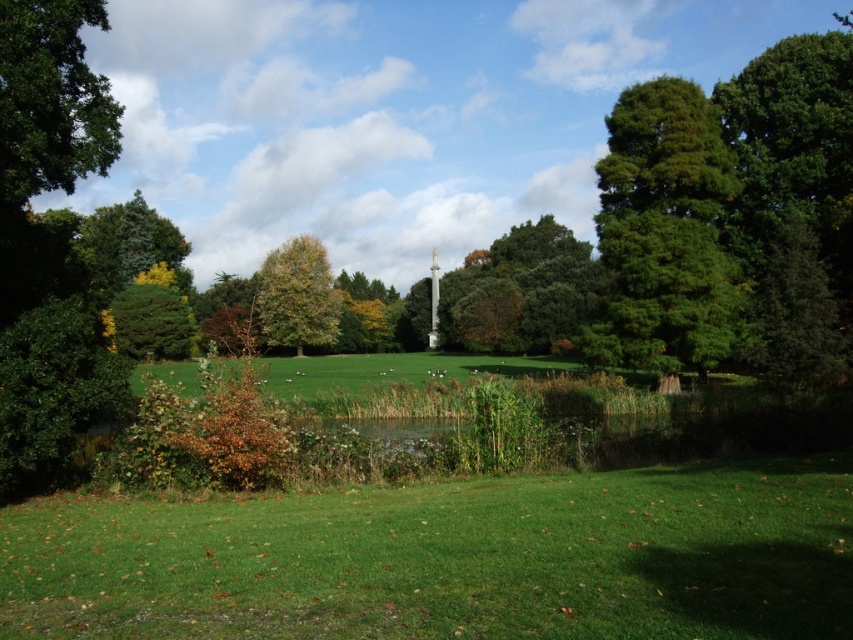
You are standing in the park and want to take a photo of the green leafy tree at upper left without the green grassy field at lower center blocking the view. Is this possible?

A: The green grassy field at lower center is in front of the green leafy tree at upper left, so it will block the view. Move to a higher position or angle your camera upwards to avoid the obstruction.

You are standing in the park and want to walk from the green leafy tree at center to the green grassy field at lower center. Which direction should you head?

To reach the green grassy field at lower center from the green leafy tree at center, you should head to the right since the green grassy field at lower center is located to the right of the green leafy tree at center.

You are standing at the origin point in the park and want to reach the green grassy field at lower center. What are the coordinates you need to move to?

The green grassy field at lower center is located at coordinates point (450, 560). So you need to move to point (450, 560).